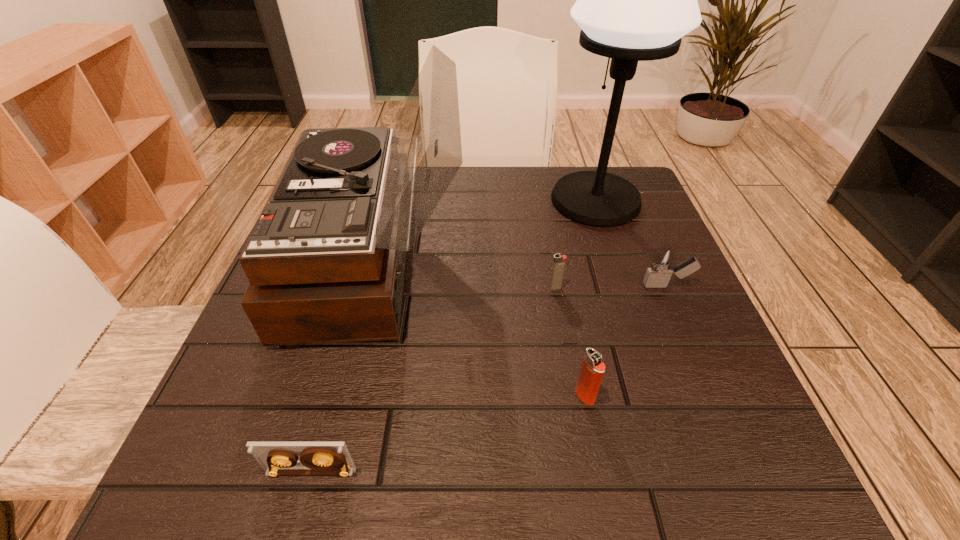
At what (x,y) coordinates should I click in order to perform the action: click on table lamp. Please return your answer as a coordinate pair (x, y). Image resolution: width=960 pixels, height=540 pixels. Looking at the image, I should click on (635, 0).

Locate an element on the screen. The image size is (960, 540). record player is located at coordinates (326, 259).

Locate an element on the screen. This screenshot has width=960, height=540. the fifth farthest object is located at coordinates [x=592, y=370].

Image resolution: width=960 pixels, height=540 pixels. I want to click on the rightmost igniter, so click(x=662, y=265).

Identify the location of videotape. (277, 458).

Locate an element on the screen. vacant space located 0.350m on the left of the tallest object is located at coordinates (403, 200).

This screenshot has height=540, width=960. Find the location of `free spot located on the right of the record player`. free spot located on the right of the record player is located at coordinates (498, 260).

Identify the location of free space located 0.110m on the right of the second nearest object. coord(664,396).

Find the location of a particular element. This screenshot has height=540, width=960. blank space located on the left of the rightmost igniter is located at coordinates (519, 286).

Locate an element on the screen. table lamp positioned at the far edge is located at coordinates (635, 0).